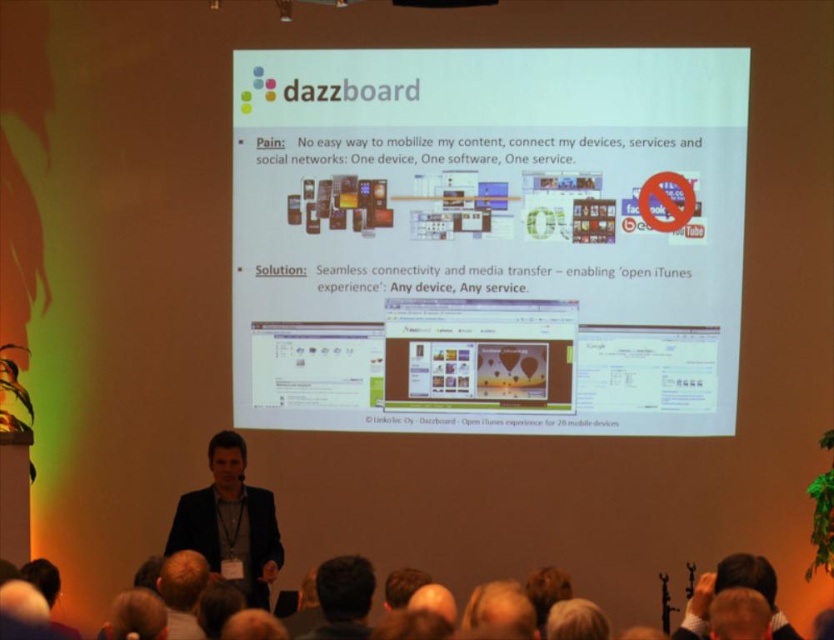
You are a photographer at the back of the room. You need to take a photo of the dark suit at lower left and dark brown hair at lower center. Which object should you focus on first if you want to capture both in a single shot without moving the camera?

You should focus on the dark brown hair at lower center first because the dark suit at lower left is located above it, so adjusting focus to the closer object ensures both are in the same focal plane.

You are a photographer standing in front of the presentation scene. You need to capture a photo that includes both the dark suit at lower left and the dark brown hair at lower center. The camera you are using has a maximum focus range of 36 inches. Will you be able to capture both subjects in focus without moving the camera?

The dark suit at lower left and dark brown hair at lower center are 36.90 inches apart from each other. Since the camera can only focus within 36 inches, the distance between them exceeds the maximum focus range. Therefore, you cannot capture both subjects in focus without moving the camera.

You are a photographer positioned at the back of the room. You want to take a photo of the black suit at center but also include the dark suit at lower left in the frame. Which person should you focus on first to ensure both are in focus?

You should focus on the dark suit at lower left first because it is closer to the viewer than the black suit at center, so focusing on the closer subject increases the chance of both being in focus.